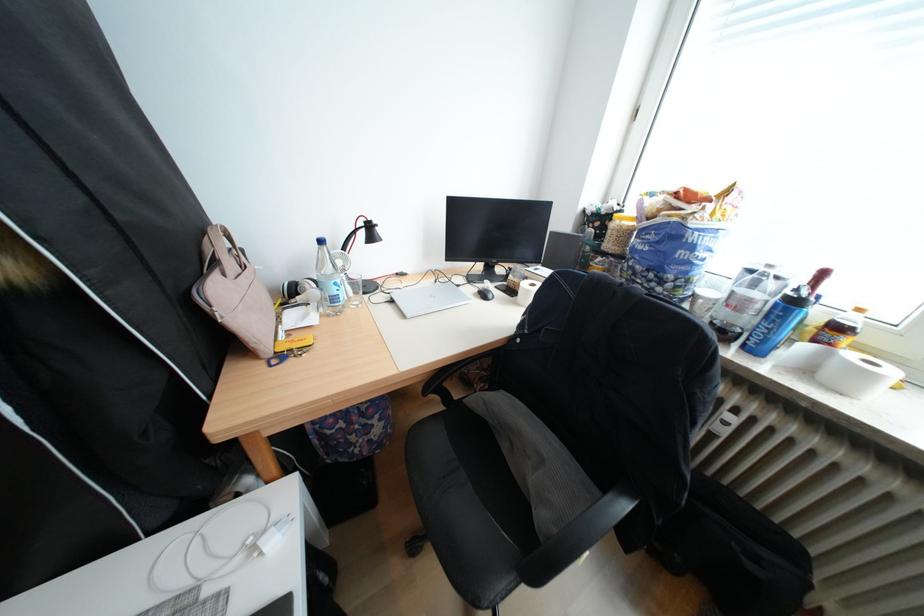
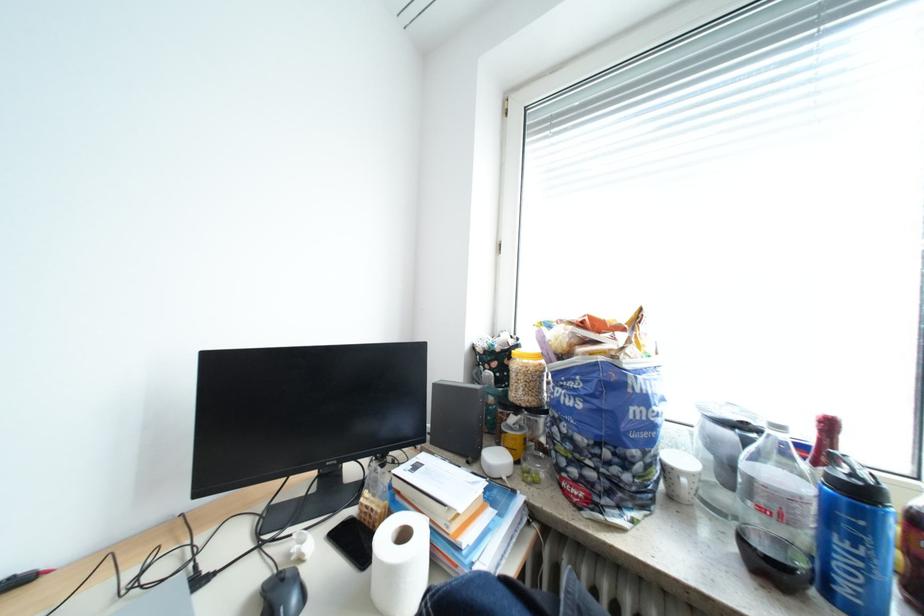
The point at (762, 302) is marked in the first image. Where is the corresponding point in the second image?

(807, 499)